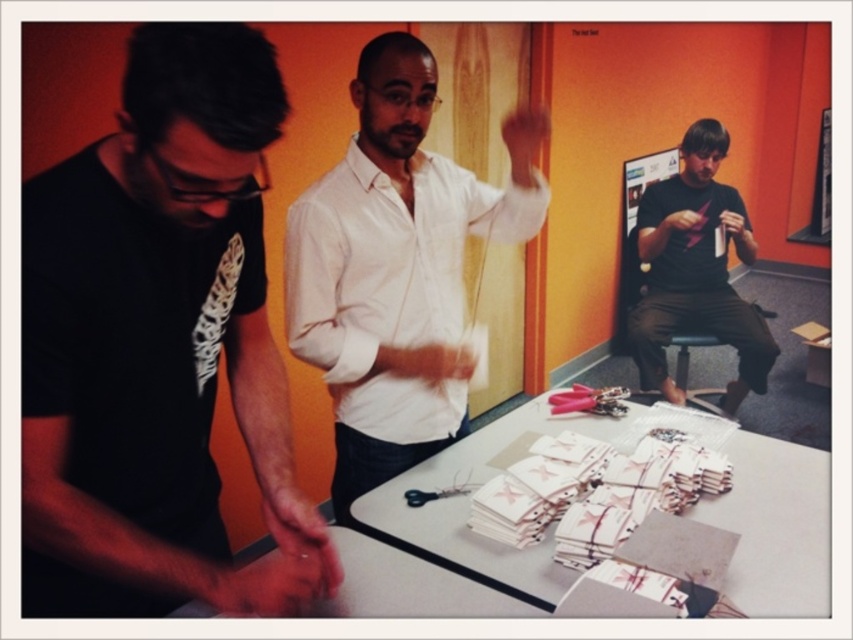
You are organizing a craft project and need to place a decorative ribbon between the white paper at center and the matte black shirt at right. Based on their positions, where should you place the ribbon?

The white paper at center is positioned on the left side of the matte black shirt at right, so you should place the ribbon to the left of the matte black shirt at right or to the right of the white paper at center to ensure it is between them.